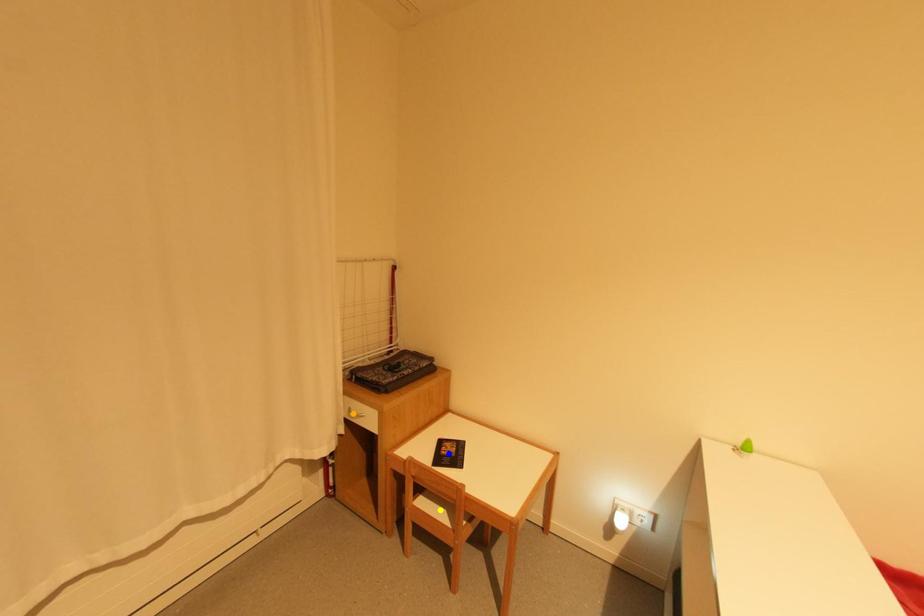
Order these from nearest to farthest:
yellow point, orange point, blue point

yellow point → orange point → blue point